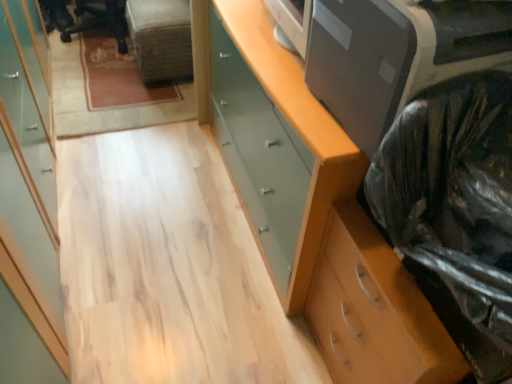
Question: Would you say black plastic bag at right is to the left or to the right of wooden chest of drawers at right, which is the second chest of drawers in top-to-bottom order, in the picture?

Choices:
 (A) left
 (B) right

Answer: (A)

Question: In terms of width, does black plastic bag at right look wider or thinner when compared to wooden chest of drawers at right, which is the 1th chest of drawers from bottom to top?

Choices:
 (A) wide
 (B) thin

Answer: (B)

Question: Estimate the real-world distances between objects in this image. Which object is closer to the black plastic chair at upper left?

Choices:
 (A) light wood cabinet at left
 (B) satin gray printer at upper right
 (C) wooden chest of drawers at right, which is the 1th chest of drawers from bottom to top
 (D) black plastic bag at right
 (E) matte green chest of drawers at right, the 2th chest of drawers in the bottom-to-top sequence

Answer: (A)

Question: Estimate the real-world distances between objects in this image. Which object is farther from the matte green chest of drawers at right, the 2th chest of drawers in the bottom-to-top sequence?

Choices:
 (A) black plastic chair at upper left
 (B) satin gray printer at upper right
 (C) black plastic bag at right
 (D) light wood cabinet at left
 (E) wooden chest of drawers at right, which is the 1th chest of drawers from bottom to top

Answer: (A)